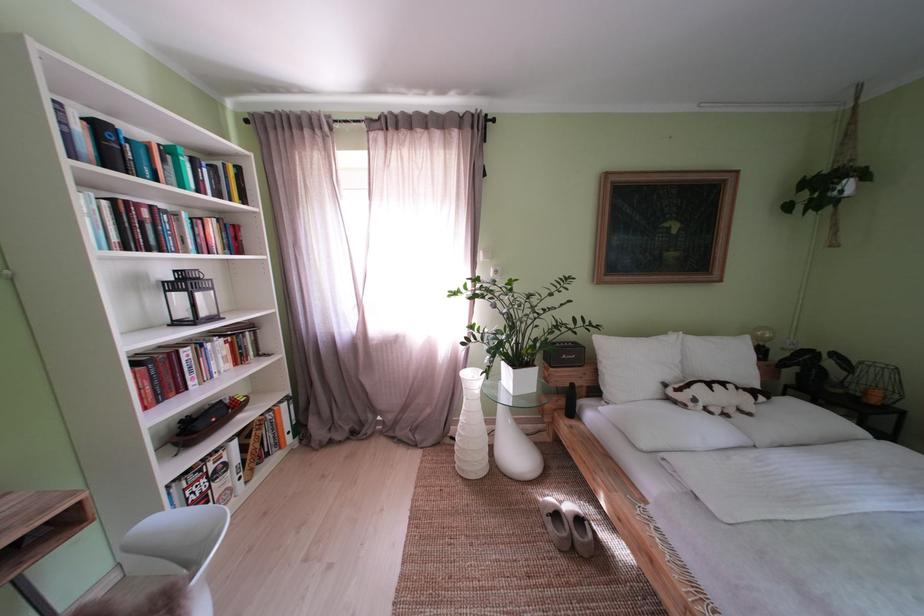
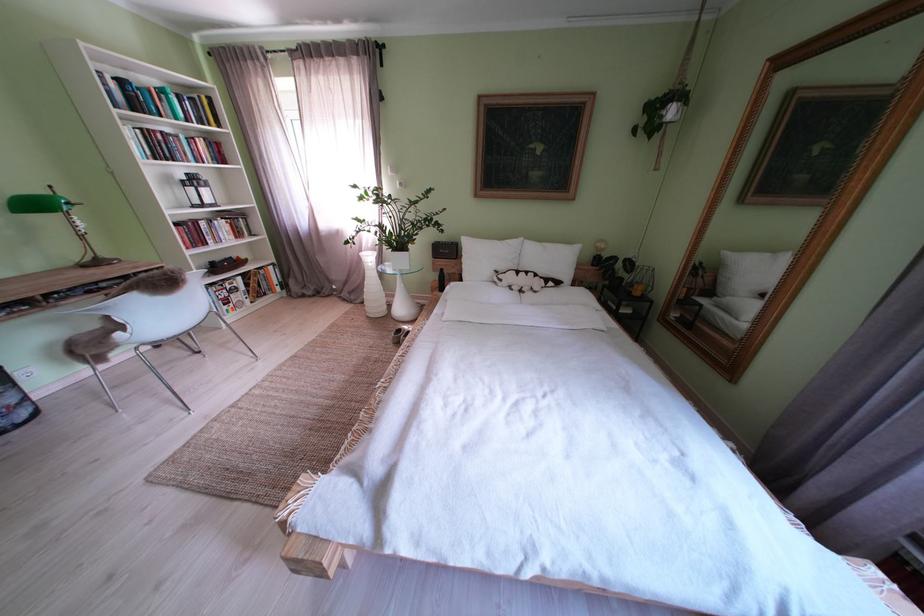
Locate, in the second image, the point that corresponds to [706,406] in the first image.

(512, 285)